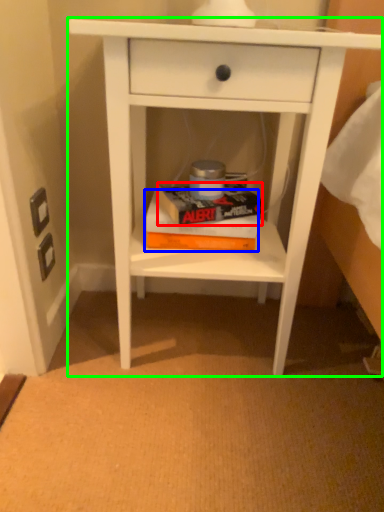
Question: Which object is positioned farthest from paperback book (highlighted by a red box)? Select from paperback book (highlighted by a blue box) and nightstand (highlighted by a green box).

Choices:
 (A) paperback book
 (B) nightstand

Answer: (B)